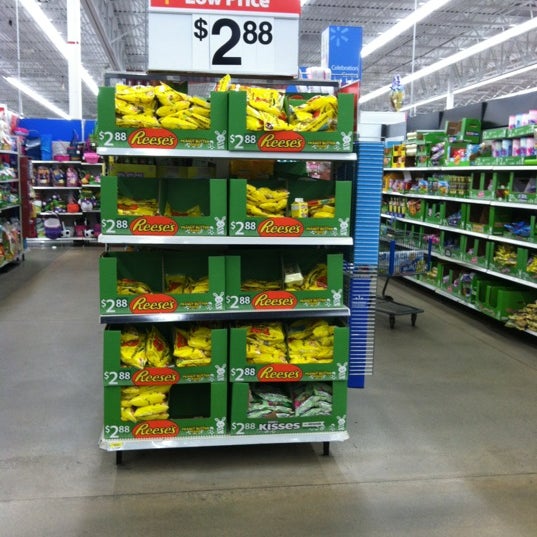
Where is `shelves`? The width and height of the screenshot is (537, 537). shelves is located at coordinates (60, 185), (68, 206), (74, 226), (476, 297), (473, 253), (464, 214), (465, 178), (491, 151).